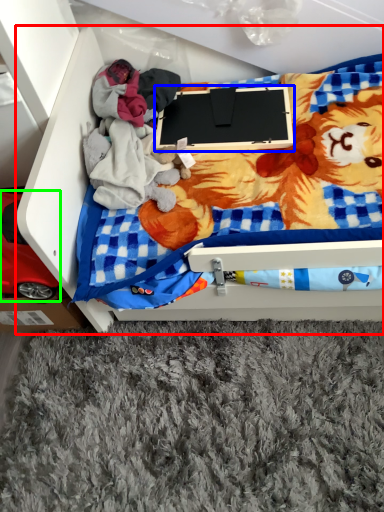
Question: Which is nearer to the furniture (highlighted by a red box)? laptop (highlighted by a blue box) or toy (highlighted by a green box).

Choices:
 (A) laptop
 (B) toy

Answer: (B)